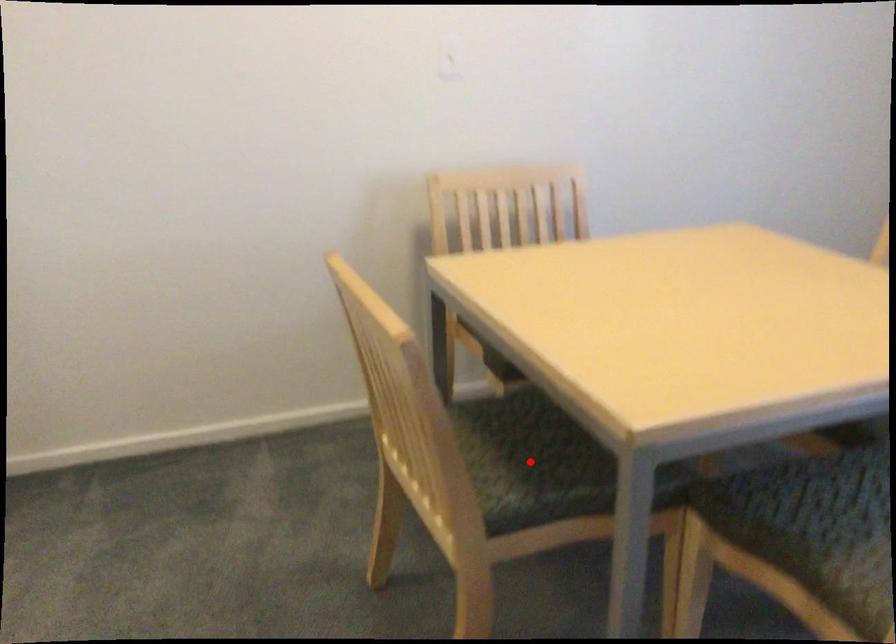
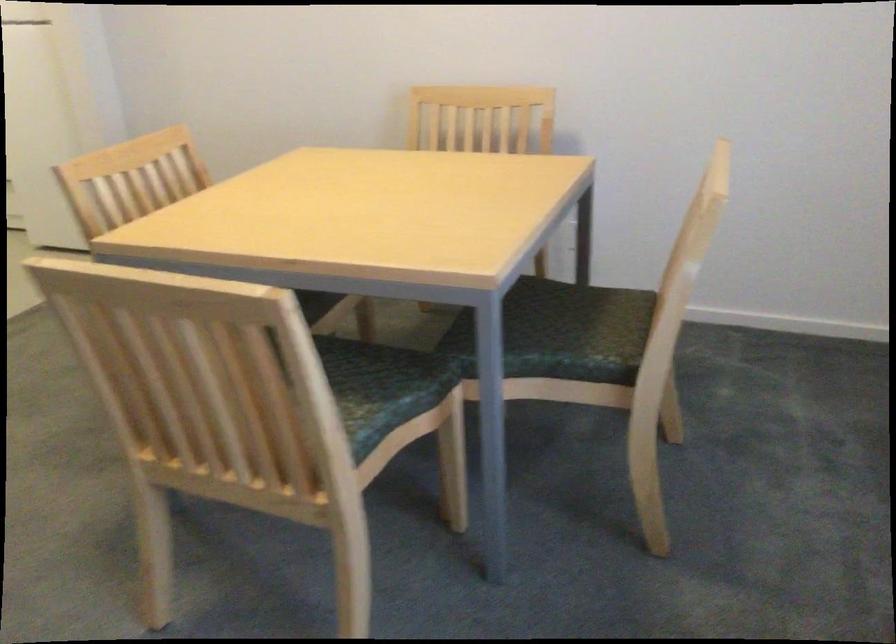
Question: I am providing you with two images of the same scene from different viewpoints. A red point is marked on the first image. At the location where the point appears in image 1, is it still visible in image 2?

Choices:
 (A) Yes
 (B) No

Answer: (B)